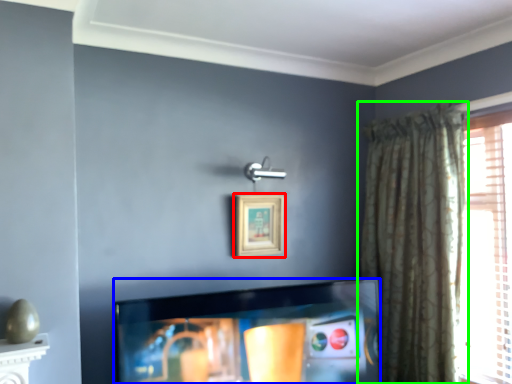
Question: Which is farther away from picture frame (highlighted by a red box)? television (highlighted by a blue box) or curtain (highlighted by a green box)?

Choices:
 (A) television
 (B) curtain

Answer: (B)